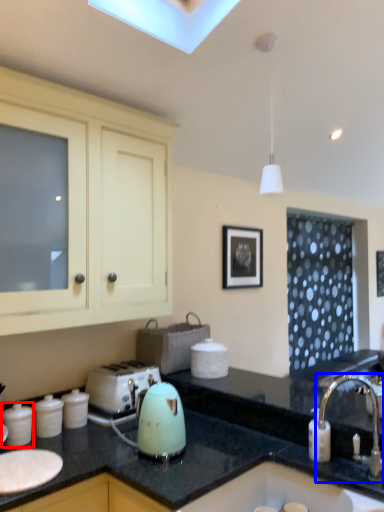
Question: Which object appears closest to the camera in this image, kitchen appliance (highlighted by a red box) or tap (highlighted by a blue box)?

Choices:
 (A) kitchen appliance
 (B) tap

Answer: (B)